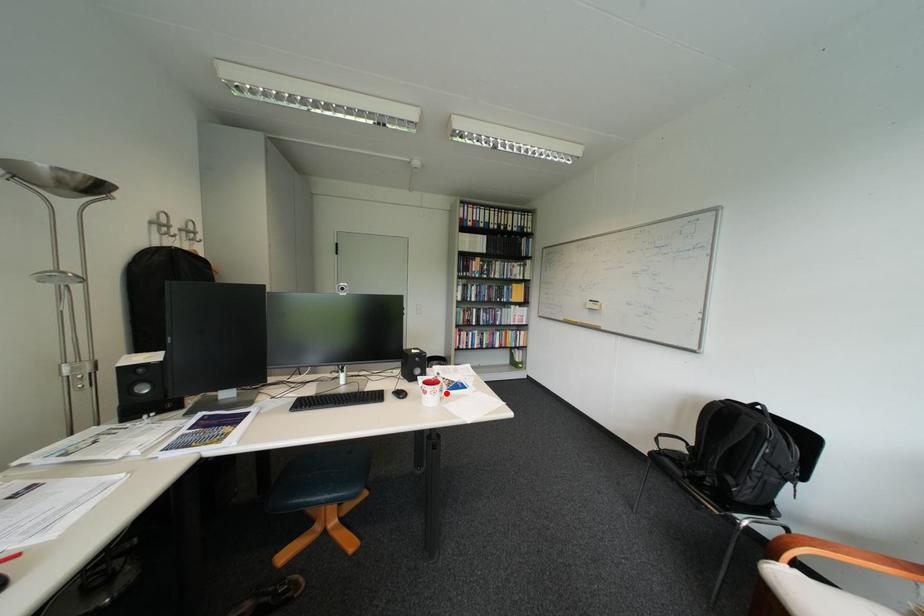
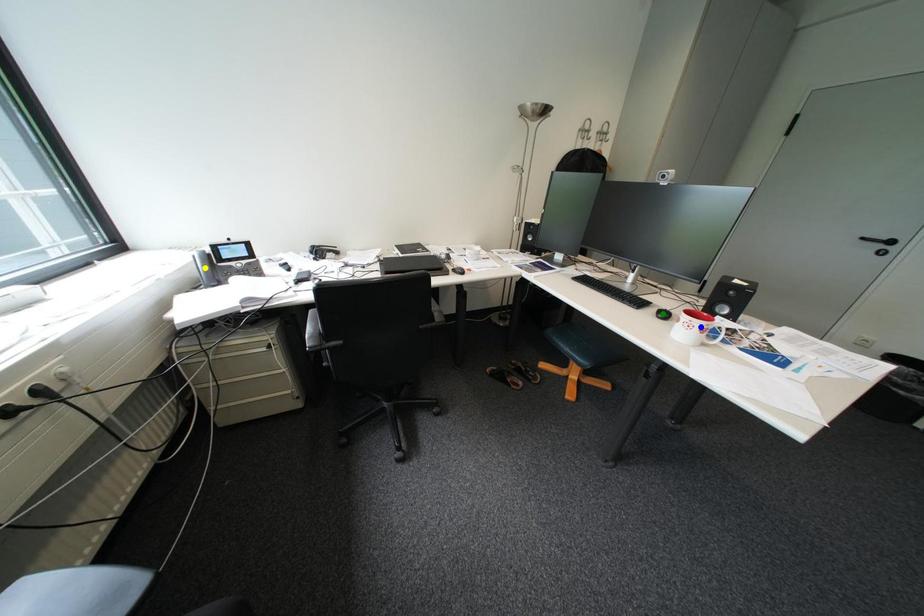
Question: I am providing you with two images of the same scene from different viewpoints. A red point is marked on the first image. You are given multiple points on the second image. Which mark in image 2 goes with the point in image 1?

Choices:
 (A) yellow point
 (B) blue point
 (C) green point

Answer: (B)